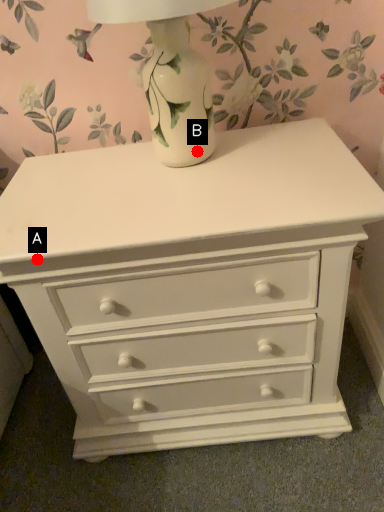
Question: Two points are circled on the image, labeled by A and B beside each circle. Which point is further to the camera?

Choices:
 (A) A is further
 (B) B is further

Answer: (B)